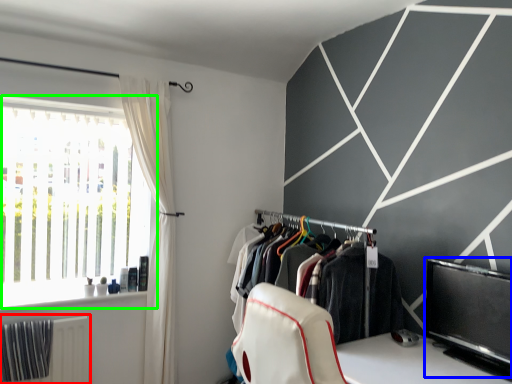
Question: Considering the real-world distances, which object is closest to radiator (highlighted by a red box)? window screen (highlighted by a blue box) or window (highlighted by a green box).

Choices:
 (A) window screen
 (B) window

Answer: (B)